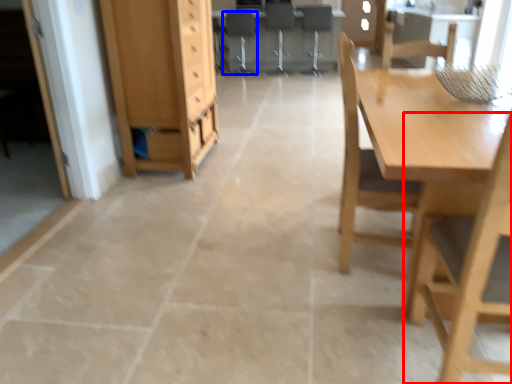
Question: Which point is closer to the camera, chair (highlighted by a red box) or chair (highlighted by a blue box)?

Choices:
 (A) chair
 (B) chair

Answer: (A)